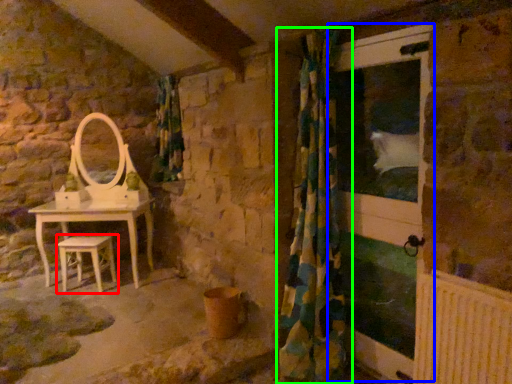
Question: Estimate the real-world distances between objects in this image. Which object is closer to stool (highlighted by a red box), screen door (highlighted by a blue box) or curtain (highlighted by a green box)?

Choices:
 (A) screen door
 (B) curtain

Answer: (B)